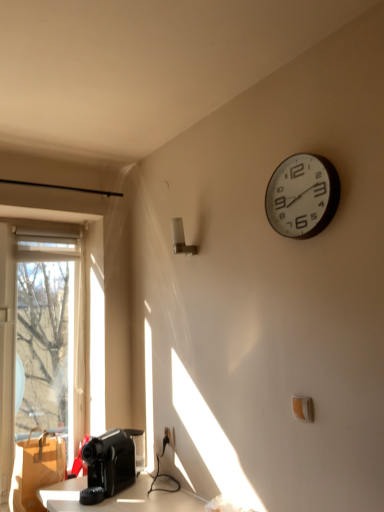
Question: Is black plastic coffee machine at lower left to the right of brown cardboard box at lower left from the viewer's perspective?

Choices:
 (A) yes
 (B) no

Answer: (A)

Question: Can we say black plastic coffee machine at lower left lies outside brown cardboard box at lower left?

Choices:
 (A) no
 (B) yes

Answer: (B)

Question: Would you consider black plastic coffee machine at lower left to be distant from brown cardboard box at lower left?

Choices:
 (A) yes
 (B) no

Answer: (B)

Question: Can you confirm if black plastic coffee machine at lower left is positioned to the left of brown cardboard box at lower left?

Choices:
 (A) no
 (B) yes

Answer: (A)

Question: Is black plastic coffee machine at lower left facing towards brown cardboard box at lower left?

Choices:
 (A) yes
 (B) no

Answer: (B)

Question: Is point (44, 449) closer or farther from the camera than point (112, 455)?

Choices:
 (A) farther
 (B) closer

Answer: (A)

Question: From the image's perspective, is brown cardboard box at lower left positioned above or below black plastic coffee machine at lower left?

Choices:
 (A) below
 (B) above

Answer: (A)

Question: Would you say brown cardboard box at lower left is to the left or to the right of black plastic coffee machine at lower left in the picture?

Choices:
 (A) left
 (B) right

Answer: (A)

Question: In terms of size, does brown cardboard box at lower left appear bigger or smaller than black plastic coffee machine at lower left?

Choices:
 (A) big
 (B) small

Answer: (A)

Question: Considering the positions of brown cardboard box at lower left and white plastic wall clock at upper right in the image, is brown cardboard box at lower left wider or thinner than white plastic wall clock at upper right?

Choices:
 (A) wide
 (B) thin

Answer: (A)

Question: Relative to white plastic wall clock at upper right, is brown cardboard box at lower left in front or behind?

Choices:
 (A) front
 (B) behind

Answer: (B)

Question: Is brown cardboard box at lower left inside the boundaries of white plastic wall clock at upper right, or outside?

Choices:
 (A) outside
 (B) inside

Answer: (A)

Question: Based on their sizes in the image, would you say brown cardboard box at lower left is bigger or smaller than white plastic wall clock at upper right?

Choices:
 (A) small
 (B) big

Answer: (B)

Question: Is point (102, 465) closer or farther from the camera than point (38, 449)?

Choices:
 (A) farther
 (B) closer

Answer: (B)

Question: From a real-world perspective, relative to brown cardboard box at lower left, is black plastic coffee machine at lower left vertically above or below?

Choices:
 (A) above
 (B) below

Answer: (A)